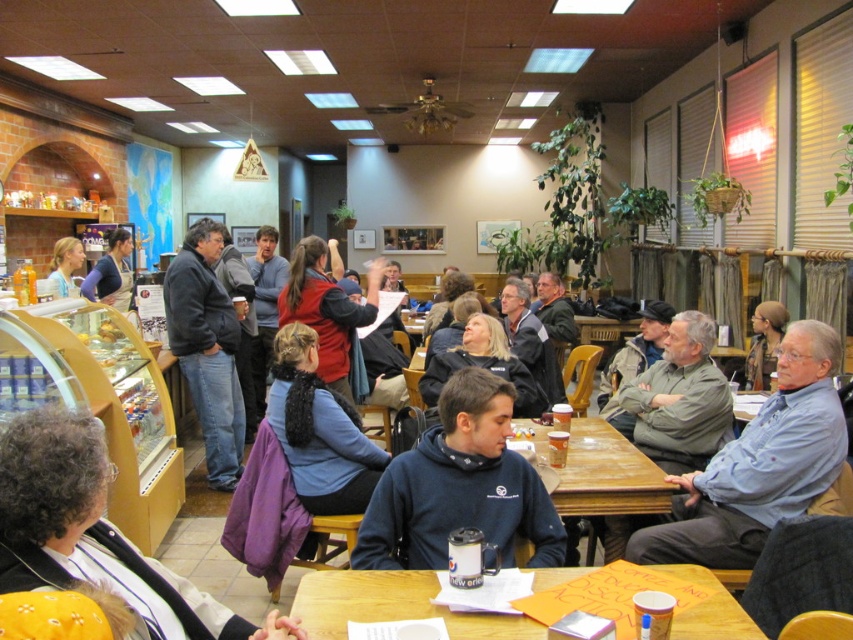
Question: Which object appears farthest from the camera in this image?

Choices:
 (A) blue denim shirt at center
 (B) matte blue shirt at upper left
 (C) gray wool sweater at center
 (D) dark blue jacket at center

Answer: (B)

Question: Which object is positioned farthest from the matte blue apron at left?

Choices:
 (A) gray wool sweater at center
 (B) matte blue shirt at upper left
 (C) white textured sweater at lower left
 (D) wooden table at lower center

Answer: (C)

Question: Does wooden table at center appear over red velvet sweater at center?

Choices:
 (A) no
 (B) yes

Answer: (A)

Question: Can you confirm if navy blue hoodie at center is thinner than wooden table at center?

Choices:
 (A) no
 (B) yes

Answer: (A)

Question: Which point is closer to the camera?

Choices:
 (A) (630, 538)
 (B) (39, 576)
 (C) (357, 460)

Answer: (B)

Question: Does matte blue apron at left have a larger size compared to matte black jacket at center?

Choices:
 (A) yes
 (B) no

Answer: (A)